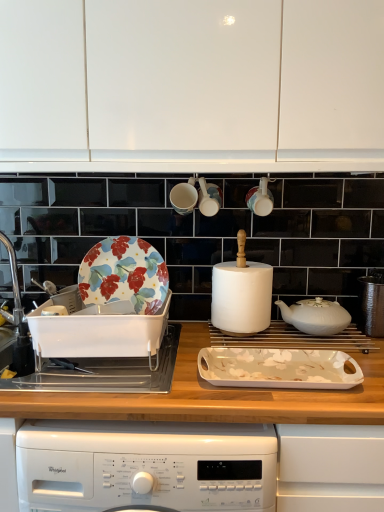
Locate an element on the screen. The image size is (384, 512). vacant area situated to the left side of white matte paper towel at center is located at coordinates (193, 329).